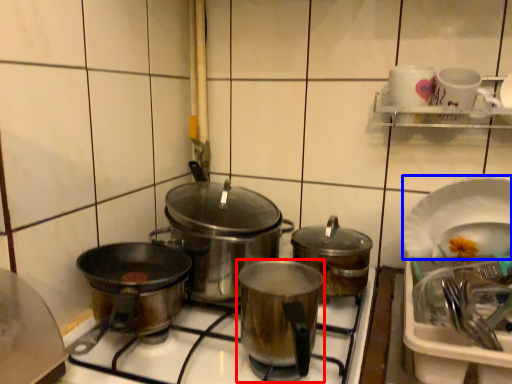
Question: Among these objects, which one is farthest to the camera, kitchen appliance (highlighted by a red box) or platter (highlighted by a blue box)?

Choices:
 (A) kitchen appliance
 (B) platter

Answer: (B)